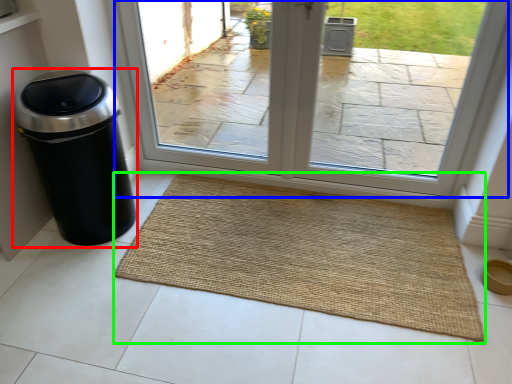
Question: Based on their relative distances, which object is nearer to waste container (highlighted by a red box)? Choose from window (highlighted by a blue box) and mat (highlighted by a green box).

Choices:
 (A) window
 (B) mat

Answer: (B)